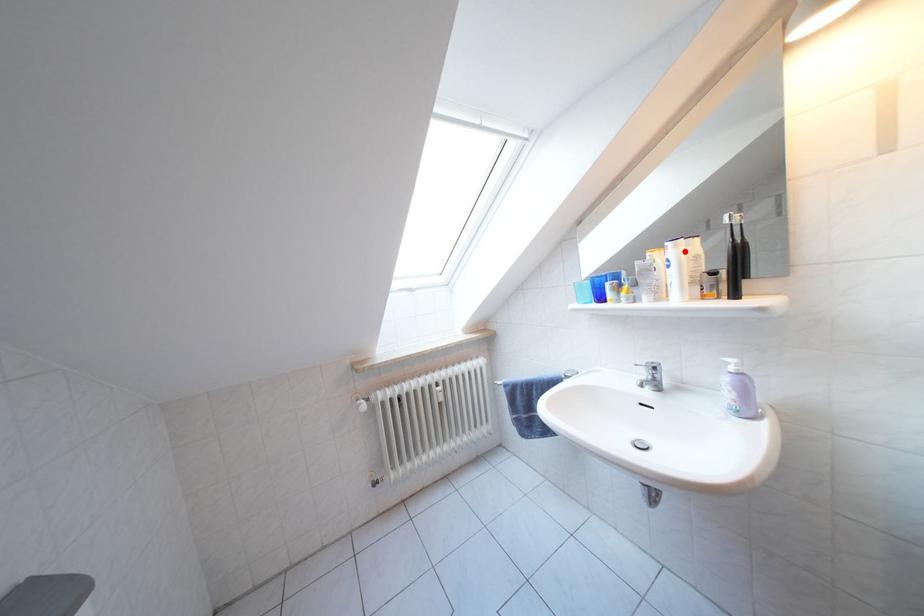
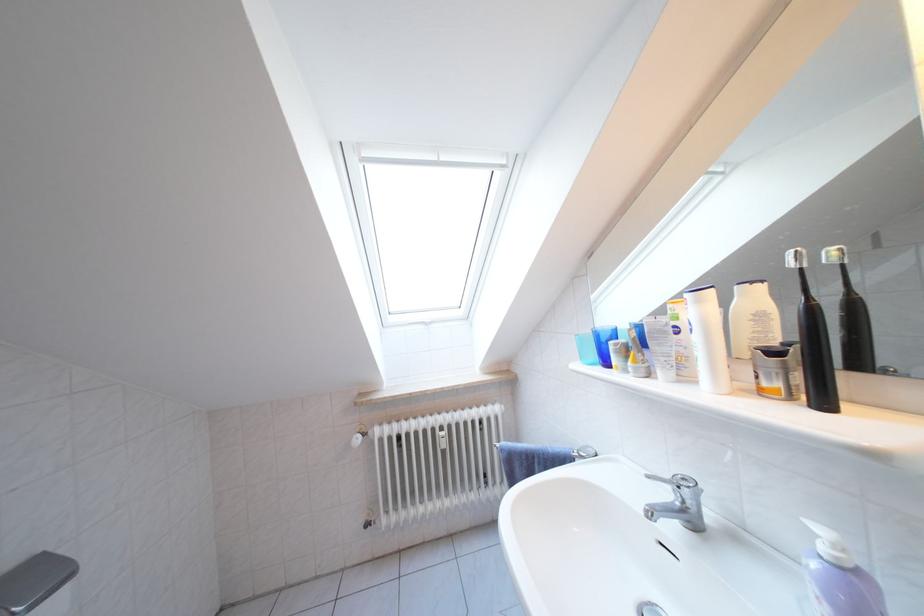
Where in the second image is the point corresponding to the highlighted location from the first image?

(708, 306)